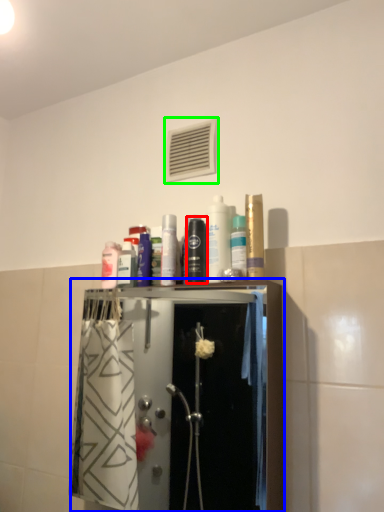
Question: Which object is positioned closest to mouthwash (highlighted by a red box)? Select from closet (highlighted by a blue box) and air conditioning (highlighted by a green box).

Choices:
 (A) closet
 (B) air conditioning

Answer: (B)